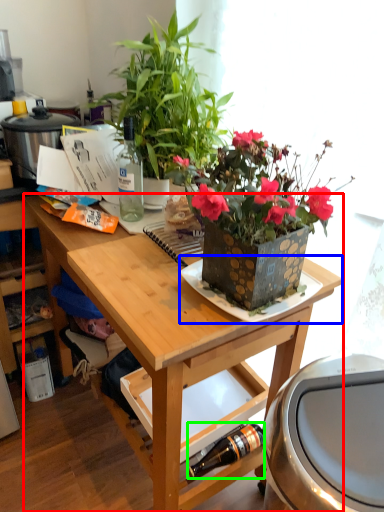
Question: Estimate the real-world distances between objects in this image. Which object is farther from desk (highlighted by a red box), plate (highlighted by a blue box) or bottle (highlighted by a green box)?

Choices:
 (A) plate
 (B) bottle

Answer: (B)